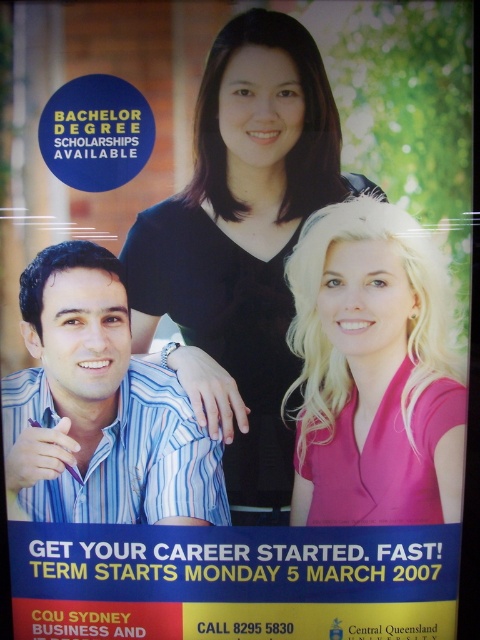
You are a photographer adjusting the lighting for a promotional poster. You need to ensure that the pink satin blouse at right and the blue striped shirt at lower left are both well lit. Based on their positions, which item should you focus the light on first to account for their depth?

The pink satin blouse at right is closer to the viewer than the blue striped shirt at lower left, so you should focus the light on the pink satin blouse at right first to ensure proper exposure due to its closer proximity.

Based on the scene description, which object has a larger size between the black matte shirt at center and the pink satin blouse at right?

The black matte shirt at center has a larger size compared to the pink satin blouse at right.